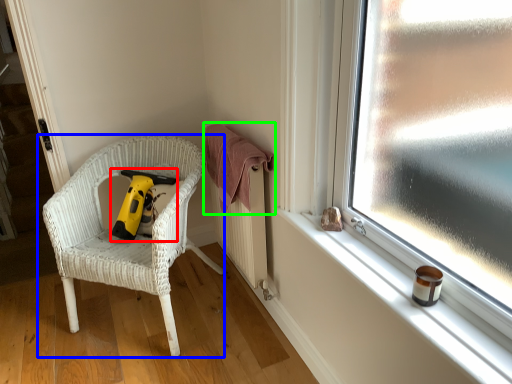
Question: Based on their relative distances, which object is farther from vacuum (highlighted by a red box)? Choose from chair (highlighted by a blue box) and clothe (highlighted by a green box).

Choices:
 (A) chair
 (B) clothe

Answer: (B)